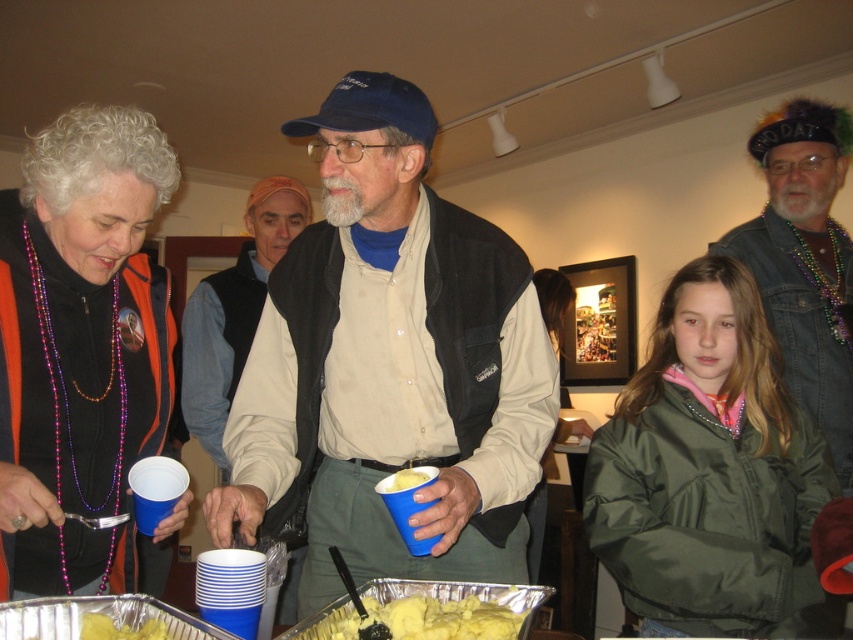
What do you see at coordinates (390, 364) in the screenshot? I see `matte black vest at center` at bounding box center [390, 364].

Which is more to the right, matte black vest at center or denim jacket at upper right?

denim jacket at upper right is more to the right.

This screenshot has height=640, width=853. What do you see at coordinates (390, 364) in the screenshot?
I see `matte black vest at center` at bounding box center [390, 364].

Find the location of `matte black vest at center`. matte black vest at center is located at coordinates 390,364.

Is point (144, 432) farther from viewer compared to point (142, 634)?

Yes, point (144, 432) is behind point (142, 634).

From the picture: Can you confirm if orange fabric vest at left is bigger than yellow matte mashed potatoes at lower left?

Correct, orange fabric vest at left is larger in size than yellow matte mashed potatoes at lower left.

Is point (123, 435) farther from viewer compared to point (91, 637)?

That is True.

At what (x,y) coordinates should I click in order to perform the action: click on orange fabric vest at left. Please return your answer as a coordinate pair (x, y). Looking at the image, I should click on (80, 342).

Does denim jacket at upper right have a greater width compared to yellow mashed potatoes at center?

Yes.

Is point (815, 141) in front of point (434, 609)?

No, it is behind (434, 609).

Is point (801, 390) behind point (431, 625)?

Yes.

Where is `denim jacket at upper right`? The width and height of the screenshot is (853, 640). denim jacket at upper right is located at coordinates (805, 260).